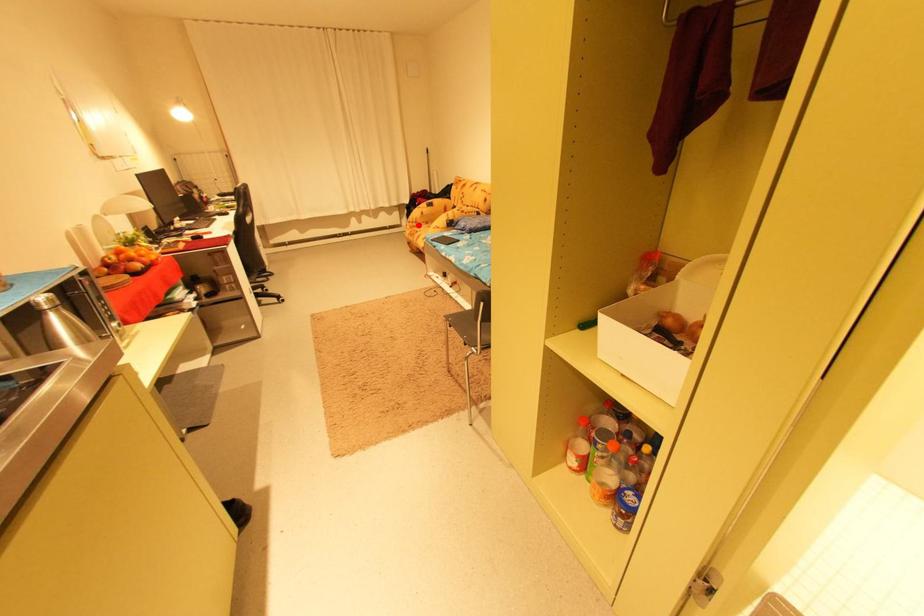
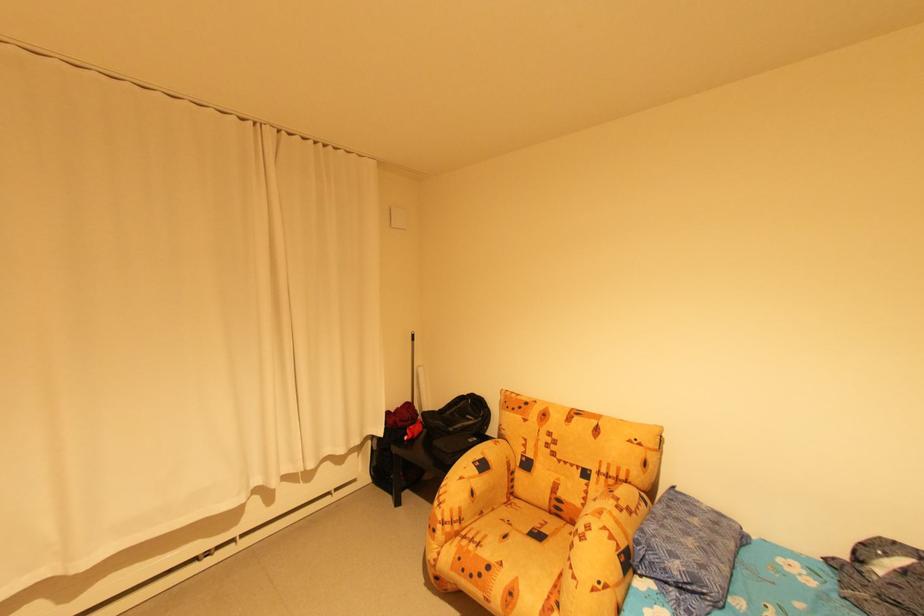
Question: I am providing you with two images of the same scene from different viewpoints. In image1, a red point is highlighted. Considering the same 3D point in image2, which of the following is correct?

Choices:
 (A) It is closer
 (B) It is farther

Answer: (B)